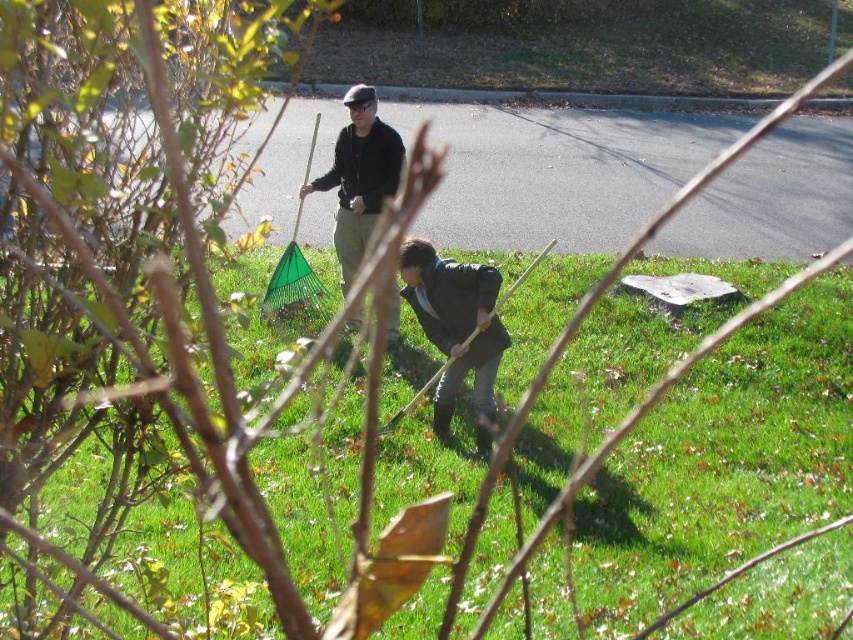
Question: Which of these objects is positioned farthest from the green grass at center?

Choices:
 (A) matte black jacket at center
 (B) dark blue suit at lower center

Answer: (A)

Question: Which point is closer to the camera?

Choices:
 (A) (374, 205)
 (B) (461, 289)
 (C) (380, 456)

Answer: (B)

Question: Can you confirm if green grass at center is positioned to the left of matte black jacket at center?

Choices:
 (A) no
 (B) yes

Answer: (A)

Question: Can you confirm if green grass at center is positioned above dark blue suit at lower center?

Choices:
 (A) no
 (B) yes

Answer: (A)

Question: Is dark blue suit at lower center thinner than matte black jacket at center?

Choices:
 (A) no
 (B) yes

Answer: (B)

Question: Which point is farther to the camera?

Choices:
 (A) dark blue suit at lower center
 (B) matte black jacket at center

Answer: (B)